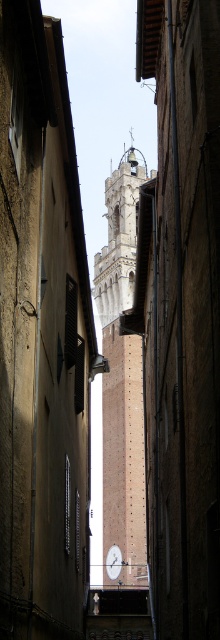
Looking at this image, is beige brick bell tower at center to the right of beige stone bell tower at center from the viewer's perspective?

Incorrect, beige brick bell tower at center is not on the right side of beige stone bell tower at center.

Is beige brick bell tower at center to the left of beige stone bell tower at center from the viewer's perspective?

Correct, you'll find beige brick bell tower at center to the left of beige stone bell tower at center.

Between point (124, 458) and point (119, 189), which one is positioned in front?

Point (124, 458)

This screenshot has height=640, width=220. What are the coordinates of `beige brick bell tower at center` in the screenshot? It's located at (122, 374).

Between point (119, 163) and point (115, 561), which one is positioned behind?

The point (119, 163) is more distant.

Does beige stone bell tower at center lie in front of white glossy clock at center?

No, beige stone bell tower at center is behind white glossy clock at center.

The height and width of the screenshot is (640, 220). Describe the element at coordinates (119, 236) in the screenshot. I see `beige stone bell tower at center` at that location.

Where is `beige stone bell tower at center`? The width and height of the screenshot is (220, 640). beige stone bell tower at center is located at coordinates (119, 236).

Is beige brick bell tower at center thinner than white glossy clock at center?

No, beige brick bell tower at center is not thinner than white glossy clock at center.

Who is more forward, (102, 355) or (117, 566)?

Point (117, 566) is in front.

Does point (124, 488) lie in front of point (108, 561)?

That is True.

Where is `beige brick bell tower at center`? This screenshot has height=640, width=220. beige brick bell tower at center is located at coordinates pyautogui.click(x=122, y=374).